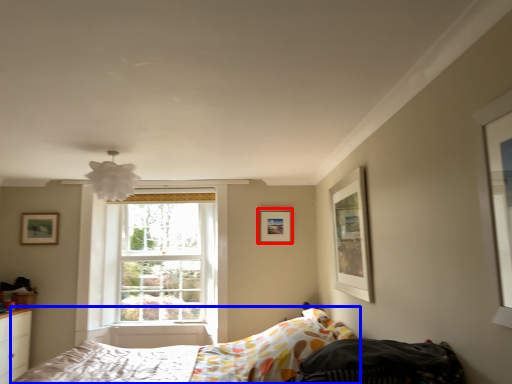
Question: Which point is closer to the camera, picture frame (highlighted by a red box) or bed (highlighted by a blue box)?

Choices:
 (A) picture frame
 (B) bed

Answer: (B)